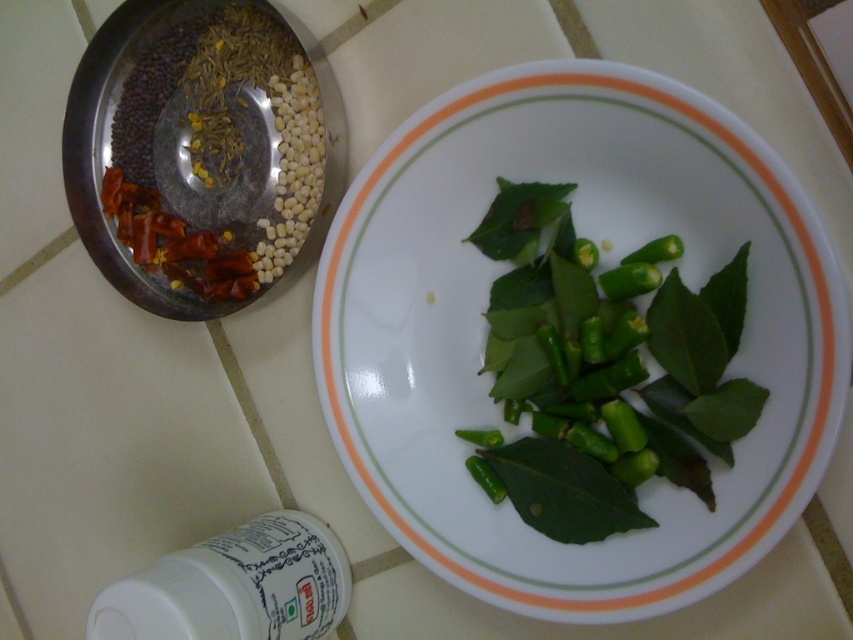
Question: Which point appears farthest from the camera in this image?

Choices:
 (A) (263, 257)
 (B) (633, 289)
 (C) (639, 234)

Answer: (A)

Question: Observing the image, what is the correct spatial positioning of green matte leaves at center in reference to metallic bowl at upper left?

Choices:
 (A) right
 (B) left

Answer: (A)

Question: Estimate the real-world distances between objects in this image. Which object is closer to the green matte leaves at center?

Choices:
 (A) metallic bowl at upper left
 (B) white glossy plate at center

Answer: (B)

Question: Considering the relative positions of green matte leaves at center and metallic bowl at upper left in the image provided, where is green matte leaves at center located with respect to metallic bowl at upper left?

Choices:
 (A) left
 (B) right

Answer: (B)

Question: Which object is positioned closest to the metallic bowl at upper left?

Choices:
 (A) green matte leaves at center
 (B) white glossy plate at center

Answer: (B)

Question: Can you confirm if white glossy plate at center is bigger than green matte leaves at center?

Choices:
 (A) no
 (B) yes

Answer: (B)